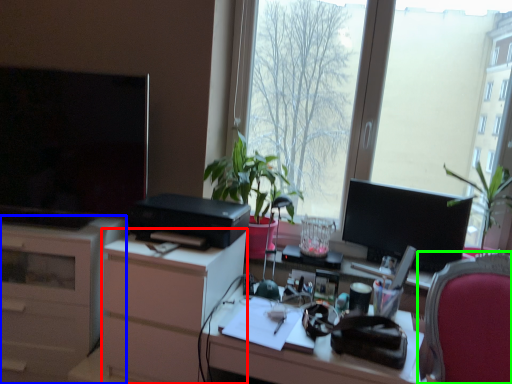
Question: Which object is positioned farthest from dresser (highlighted by a red box)? Select from cabinetry (highlighted by a blue box) and chair (highlighted by a green box).

Choices:
 (A) cabinetry
 (B) chair

Answer: (B)